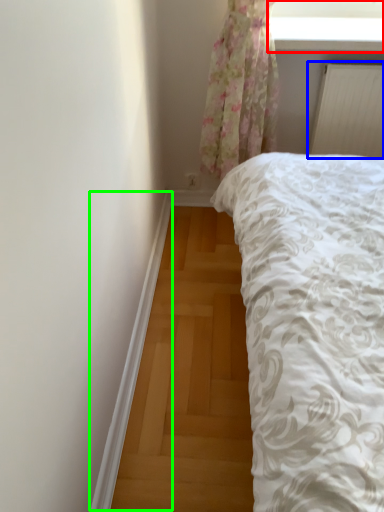
Question: Which is farther away from window screen (highlighted by a red box)? radiator (highlighted by a blue box) or trim (highlighted by a green box)?

Choices:
 (A) radiator
 (B) trim

Answer: (B)